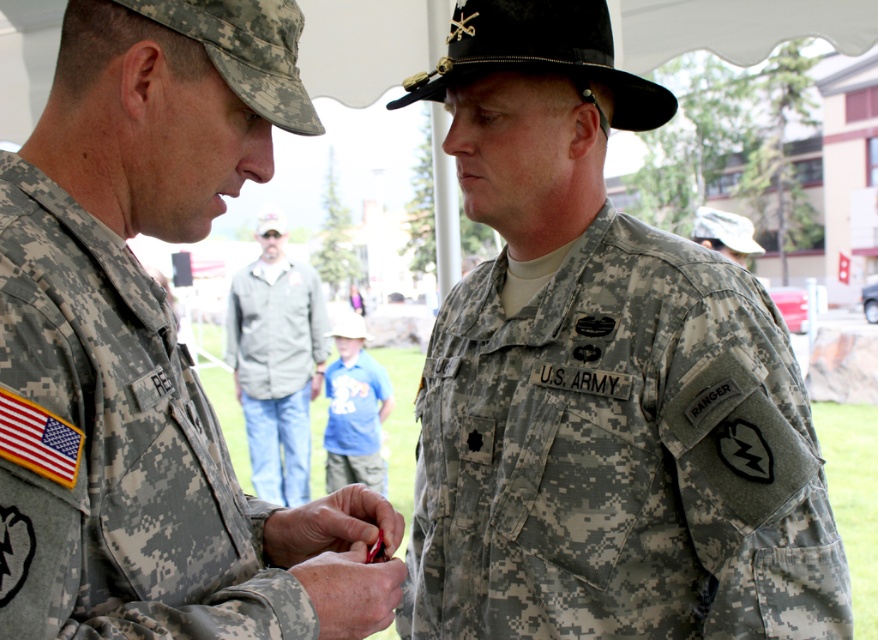
You are an observer positioned at the center of the image. Which direction should you move to get closer to the camouflage fabric us army uniform at center?

The camouflage fabric us army uniform at center is already at the center of the image, so you don not need to move in any direction to get closer.

Looking at this image, you are an observer positioned at the center of the image. Which direction should you move to get closer to the camouflage fabric us army uniform at center?

The camouflage fabric us army uniform at center is already at the center of the image, so you don not need to move in any direction to get closer.

You are a military photographer tasked with arranging two individuals for a group photo. You need to position them so that the camouflage fabric uniform at left and the gray fabric jacket at center are aligned properly. According to the scene description, which object is positioned to the right of the other?

The camouflage fabric uniform at left is positioned to the right of the gray fabric jacket at center.